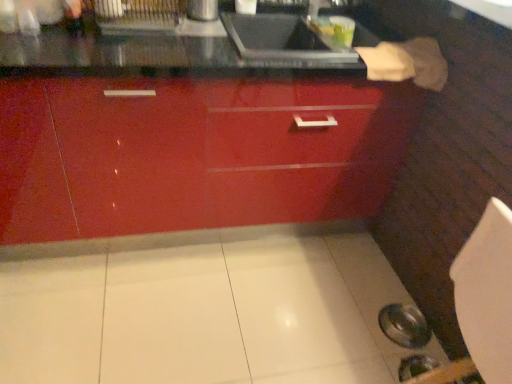
Identify the location of glossy red cabinet at center. (193, 154).

This screenshot has height=384, width=512. Describe the element at coordinates (193, 154) in the screenshot. I see `glossy red cabinet at center` at that location.

The width and height of the screenshot is (512, 384). I want to click on glossy red cabinet at center, so click(x=193, y=154).